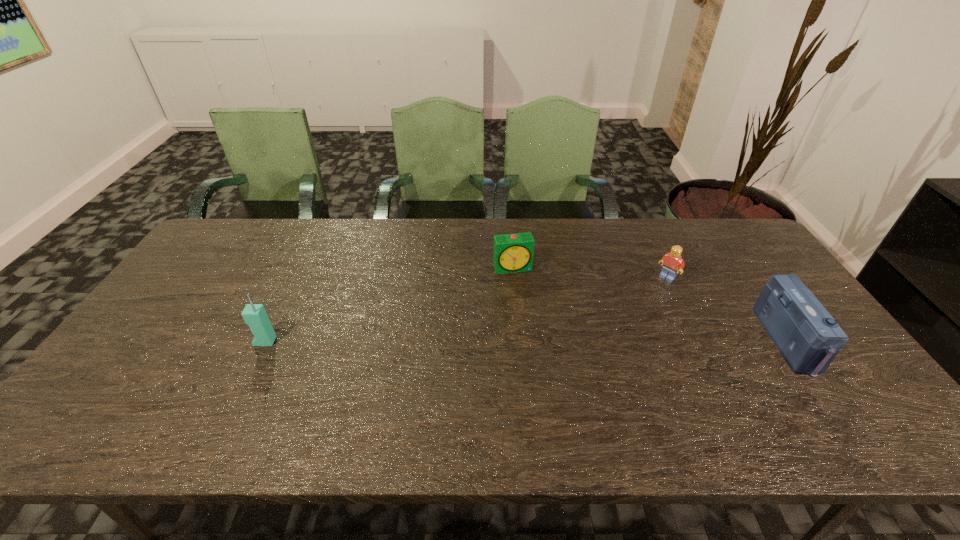
At what (x,y) coordinates should I click in order to perform the action: click on vacant space on the desktop that is between the cellular telephone and the camera and is positioned on the front-facing side of the second object from left to right. Please return your answer as a coordinate pair (x, y). This screenshot has width=960, height=540. Looking at the image, I should click on (537, 341).

The image size is (960, 540). Identify the location of free space on the desktop that is between the leftmost object and the rightmost object and is positioned on the front-facing side of the third object from left to right. (597, 341).